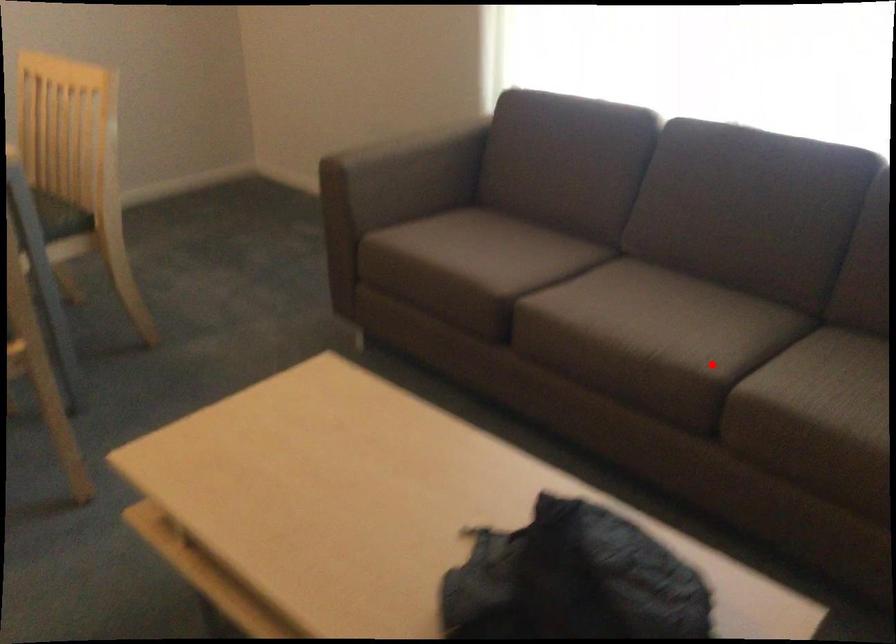
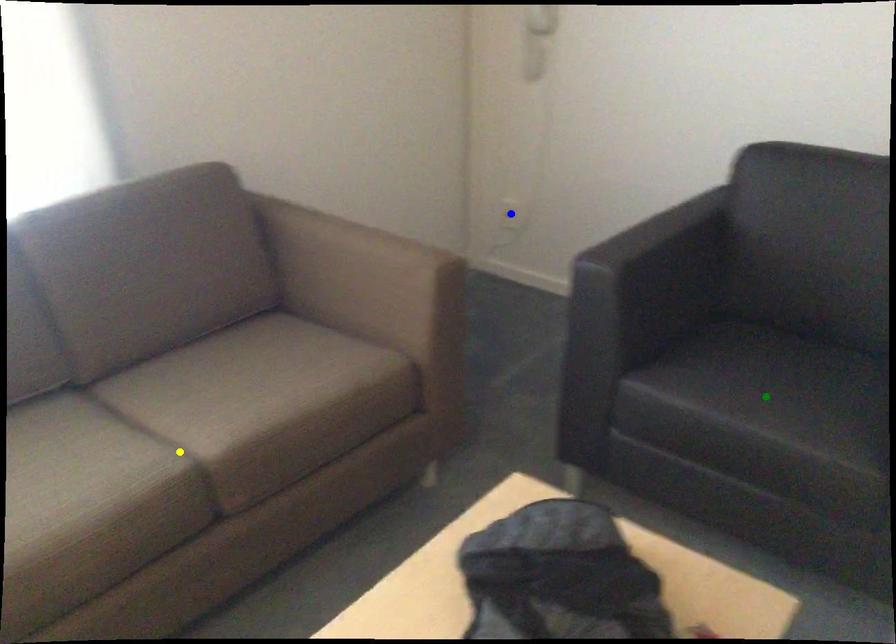
Question: I am providing you with two images of the same scene from different viewpoints. A red point is marked on the first image. You are given multiple points on the second image. Which point in image 2 represents the same 3d spot as the red point in image 1?

Choices:
 (A) yellow point
 (B) blue point
 (C) green point

Answer: (A)